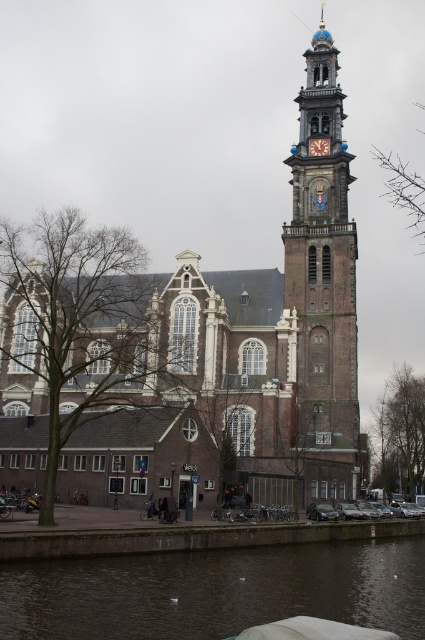
Looking at this image, you are a tourist standing on the canal side, and you want to take a photo of both the brown brick church at center and the brown brick tower at right. Which one should you frame first in your camera viewfinder to capture both in the shot?

The brown brick church at center is larger in size than the brown brick tower at right, so you should frame the larger brown brick church at center first in your camera viewfinder to ensure both fit in the shot.

You are a tourist standing on the canal side, looking at the brown brick church at center and the dark brown water at lower center. Which object appears taller from your perspective?

The brown brick church at center appears taller than the dark brown water at lower center because the brown brick church at center has a greater height compared to dark brown water at lower center.

You are standing at the point labeled as point (x=215, y=592) in the image. What do you see directly below you?

At point (x=215, y=592), you are directly above the dark brown water at lower center.